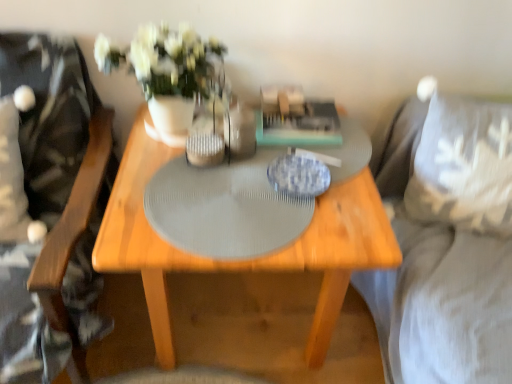
Question: Is gray textured placemat at center turned away from wooden swivel chair at left?

Choices:
 (A) yes
 (B) no

Answer: (B)

Question: Are gray textured placemat at center and wooden swivel chair at left beside each other?

Choices:
 (A) no
 (B) yes

Answer: (A)

Question: From the image's perspective, would you say gray textured placemat at center is shown under wooden swivel chair at left?

Choices:
 (A) yes
 (B) no

Answer: (B)

Question: Does gray textured placemat at center have a greater height compared to wooden swivel chair at left?

Choices:
 (A) yes
 (B) no

Answer: (B)

Question: Is gray textured placemat at center far away from wooden swivel chair at left?

Choices:
 (A) yes
 (B) no

Answer: (B)

Question: Does point (507, 299) appear closer or farther from the camera than point (34, 66)?

Choices:
 (A) closer
 (B) farther

Answer: (A)

Question: Relative to wooden swivel chair at left, is suede gray couch at right in front or behind?

Choices:
 (A) behind
 (B) front

Answer: (A)

Question: Is suede gray couch at right inside the boundaries of wooden swivel chair at left, or outside?

Choices:
 (A) inside
 (B) outside

Answer: (B)

Question: From a real-world perspective, relative to wooden swivel chair at left, is suede gray couch at right vertically above or below?

Choices:
 (A) below
 (B) above

Answer: (A)

Question: Looking at the image, does gray textured placemat at center seem bigger or smaller compared to wooden table at center?

Choices:
 (A) small
 (B) big

Answer: (A)

Question: Relative to wooden table at center, is gray textured placemat at center in front or behind?

Choices:
 (A) front
 (B) behind

Answer: (B)

Question: From the image's perspective, relative to wooden table at center, is gray textured placemat at center above or below?

Choices:
 (A) below
 (B) above

Answer: (B)

Question: From their relative heights in the image, would you say gray textured placemat at center is taller or shorter than wooden table at center?

Choices:
 (A) short
 (B) tall

Answer: (A)

Question: Visually, is white ceramic vase at center positioned to the left or to the right of gray textured placemat at center?

Choices:
 (A) left
 (B) right

Answer: (A)

Question: From the image's perspective, is white ceramic vase at center above or below gray textured placemat at center?

Choices:
 (A) below
 (B) above

Answer: (B)